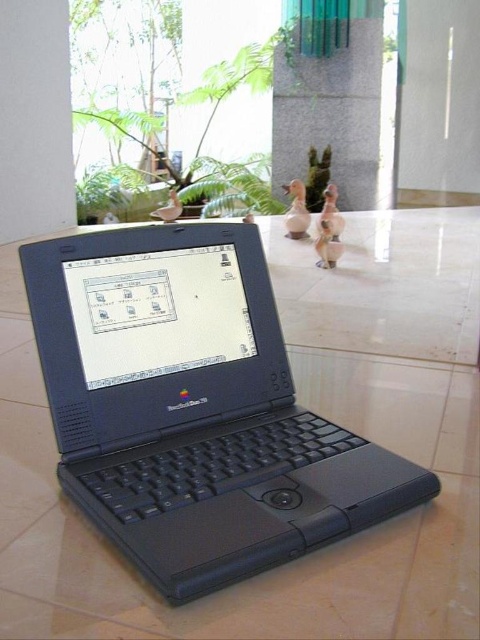
Measure the distance between black plastic laptop at center and camera.

12.32 inches

Which is more to the right, black plastic laptop at center or matte ceramic duck at center?

From the viewer's perspective, matte ceramic duck at center appears more on the right side.

Between point (233, 250) and point (324, 193), which one is positioned behind?

Point (324, 193)

Where is `black plastic laptop at center`? The image size is (480, 640). black plastic laptop at center is located at coordinates (193, 406).

Is point (327, 240) farther from viewer compared to point (287, 221)?

No, it is not.

Can you confirm if matte ceramic duck at center is positioned below matte brown duck at center?

Correct, matte ceramic duck at center is located below matte brown duck at center.

The height and width of the screenshot is (640, 480). Find the location of `matte ceramic duck at center`. matte ceramic duck at center is located at coordinates (x=327, y=228).

I want to click on matte ceramic duck at center, so click(327, 228).

Which of these two, black plastic laptop at center or matte brown duck at center, stands shorter?

matte brown duck at center

Which is more to the left, black plastic laptop at center or matte brown duck at center?

From the viewer's perspective, black plastic laptop at center appears more on the left side.

Which is in front, point (201, 444) or point (302, 232)?

Point (201, 444)

The width and height of the screenshot is (480, 640). Find the location of `black plastic laptop at center`. black plastic laptop at center is located at coordinates (193, 406).